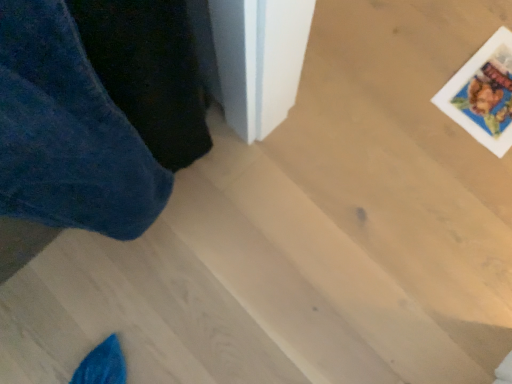
Question: Would you say printed paper postcard at upper right is inside or outside velvety blue trousers at left?

Choices:
 (A) inside
 (B) outside

Answer: (B)

Question: Considering the relative positions of printed paper postcard at upper right and velvety blue trousers at left in the image provided, is printed paper postcard at upper right to the left or to the right of velvety blue trousers at left?

Choices:
 (A) left
 (B) right

Answer: (B)

Question: Does point (501, 99) appear closer or farther from the camera than point (151, 193)?

Choices:
 (A) farther
 (B) closer

Answer: (A)

Question: From the image's perspective, is velvety blue trousers at left located above or below printed paper postcard at upper right?

Choices:
 (A) above
 (B) below

Answer: (B)

Question: Considering the positions of velvety blue trousers at left and printed paper postcard at upper right in the image, is velvety blue trousers at left taller or shorter than printed paper postcard at upper right?

Choices:
 (A) short
 (B) tall

Answer: (B)

Question: In the image, is velvety blue trousers at left positioned in front of or behind printed paper postcard at upper right?

Choices:
 (A) front
 (B) behind

Answer: (A)

Question: Looking at their shapes, would you say velvety blue trousers at left is wider or thinner than printed paper postcard at upper right?

Choices:
 (A) thin
 (B) wide

Answer: (A)